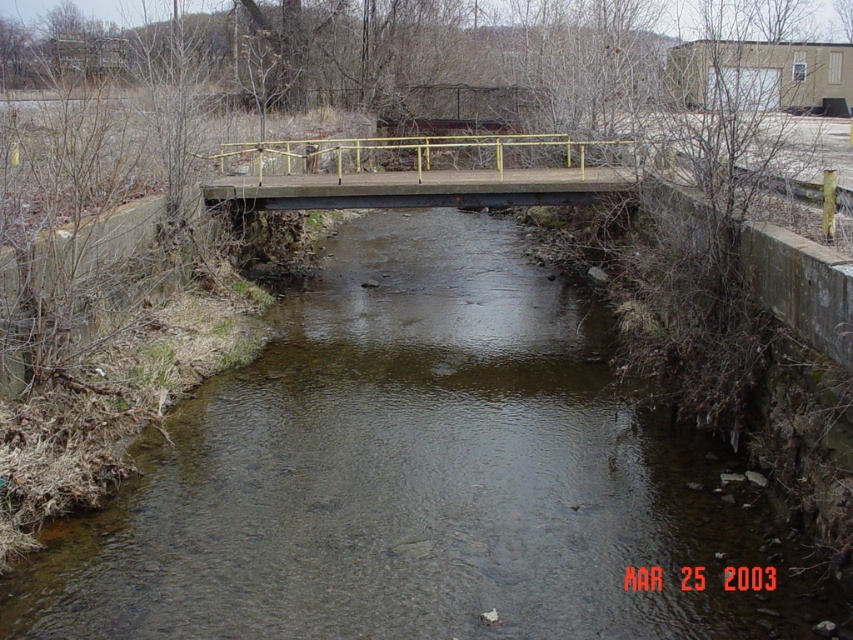
Question: Among these objects, which one is nearest to the camera?

Choices:
 (A) matte concrete bridge at center
 (B) clear water at center

Answer: (B)

Question: Which object appears farthest from the camera in this image?

Choices:
 (A) matte concrete bridge at center
 (B) clear water at center

Answer: (A)

Question: Where is clear water at center located in relation to matte concrete bridge at center in the image?

Choices:
 (A) left
 (B) right

Answer: (B)

Question: Does clear water at center lie in front of matte concrete bridge at center?

Choices:
 (A) yes
 (B) no

Answer: (A)

Question: Is clear water at center positioned in front of matte concrete bridge at center?

Choices:
 (A) no
 (B) yes

Answer: (B)